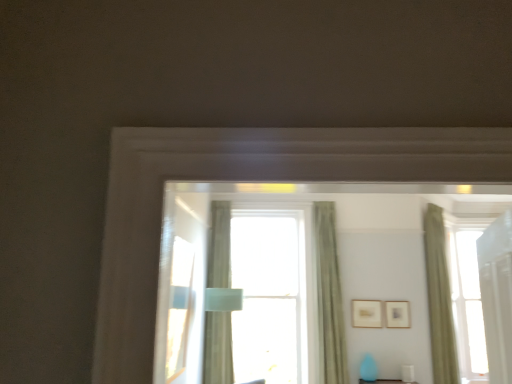
What is the approximate height of silky green curtain at center, placed as the 3th curtain when sorted from right to left?

It is 2.18 meters.

Where is `clear glass window at center`? clear glass window at center is located at coordinates (268, 295).

Find the location of a particular element. wooden picture frame at upper right, which is the 2th picture frame from right to left is located at coordinates (367, 313).

Describe the element at coordinates (367, 313) in the screenshot. I see `wooden picture frame at upper right, the first picture frame when ordered from left to right` at that location.

The width and height of the screenshot is (512, 384). In order to click on matte gold picture frame at upper center, the 2th picture frame in the left-to-right sequence in this screenshot , I will do `click(397, 314)`.

Which is in front, green textured curtain at center, placed as the 2th curtain when sorted from left to right, or silky green curtain at center, placed as the 3th curtain when sorted from right to left?

green textured curtain at center, placed as the 2th curtain when sorted from left to right, is more forward.

Between green textured curtain at center, arranged as the second curtain when viewed from the right, and silky green curtain at center, placed as the 3th curtain when sorted from right to left, which one appears on the right side from the viewer's perspective?

Positioned to the right is green textured curtain at center, arranged as the second curtain when viewed from the right.

This screenshot has height=384, width=512. I want to click on the 1st curtain below when counting from the green textured curtain at center, placed as the 2th curtain when sorted from left to right (from the image's perspective), so click(218, 349).

Who is taller, green textured curtain at center, placed as the 2th curtain when sorted from left to right, or silky green curtain at center, placed as the 3th curtain when sorted from right to left?

silky green curtain at center, placed as the 3th curtain when sorted from right to left, is taller.

Is wooden picture frame at upper right, the first picture frame when ordered from left to right, bigger than matte gold picture frame at upper center, the 2th picture frame in the left-to-right sequence?

Correct, wooden picture frame at upper right, the first picture frame when ordered from left to right, is larger in size than matte gold picture frame at upper center, the 2th picture frame in the left-to-right sequence.

The image size is (512, 384). Identify the location of picture frame located behind the matte gold picture frame at upper center, the 2th picture frame in the left-to-right sequence. (367, 313).

What's the angular difference between wooden picture frame at upper right, which is the 2th picture frame from right to left, and matte gold picture frame at upper center, positioned as the 1th picture frame in right-to-left order,'s facing directions?

The angular difference between wooden picture frame at upper right, which is the 2th picture frame from right to left, and matte gold picture frame at upper center, positioned as the 1th picture frame in right-to-left order, is 0.00336 degrees.

Considering the sizes of objects clear glass window at center and matte gold picture frame at upper center, positioned as the 1th picture frame in right-to-left order, in the image provided, who is shorter, clear glass window at center or matte gold picture frame at upper center, positioned as the 1th picture frame in right-to-left order,?

matte gold picture frame at upper center, positioned as the 1th picture frame in right-to-left order.

Is there a large distance between clear glass window at center and matte gold picture frame at upper center, the 2th picture frame in the left-to-right sequence?

Yes.

Could you tell me if clear glass window at center is turned towards matte gold picture frame at upper center, positioned as the 1th picture frame in right-to-left order?

No.

Is point (291, 326) more distant than point (406, 315)?

Yes, it is behind point (406, 315).

Is silky green curtain at center, placed as the 3th curtain when sorted from right to left, turned away from green textured curtain at center, placed as the 2th curtain when sorted from left to right?

No, silky green curtain at center, placed as the 3th curtain when sorted from right to left, is not facing away from green textured curtain at center, placed as the 2th curtain when sorted from left to right.

Which is in front, point (207, 277) or point (342, 315)?

The point (342, 315) is closer.

Would you say silky green curtain at center, the first curtain in the left-to-right sequence, is inside or outside green textured curtain at center, placed as the 2th curtain when sorted from left to right?

silky green curtain at center, the first curtain in the left-to-right sequence, is not enclosed by green textured curtain at center, placed as the 2th curtain when sorted from left to right.

Locate an element on the screen. This screenshot has width=512, height=384. curtain above the silky green curtain at center, the first curtain in the left-to-right sequence (from a real-world perspective) is located at coordinates (329, 297).

Between clear glass window at center and wooden picture frame at upper right, the first picture frame when ordered from left to right, which one has smaller size?

wooden picture frame at upper right, the first picture frame when ordered from left to right.

Is clear glass window at center not inside wooden picture frame at upper right, the first picture frame when ordered from left to right?

Yes, clear glass window at center is located beyond the bounds of wooden picture frame at upper right, the first picture frame when ordered from left to right.

Is clear glass window at center wider or thinner than wooden picture frame at upper right, the first picture frame when ordered from left to right?

In the image, clear glass window at center appears to be wider than wooden picture frame at upper right, the first picture frame when ordered from left to right.

From the image's perspective, is clear glass window at center on top of wooden picture frame at upper right, the first picture frame when ordered from left to right?

Yes, from the image's perspective, clear glass window at center is above wooden picture frame at upper right, the first picture frame when ordered from left to right.

From their relative heights in the image, would you say clear glass window at center is taller or shorter than green textured curtain at center, placed as the 2th curtain when sorted from left to right?

clear glass window at center is taller than green textured curtain at center, placed as the 2th curtain when sorted from left to right.

From the image's perspective, who appears lower, clear glass window at center or green textured curtain at center, arranged as the second curtain when viewed from the right?

clear glass window at center.

Is clear glass window at center touching green textured curtain at center, placed as the 2th curtain when sorted from left to right?

There is a gap between clear glass window at center and green textured curtain at center, placed as the 2th curtain when sorted from left to right.

Is wooden picture frame at upper right, the first picture frame when ordered from left to right, further to the viewer compared to silky green curtain at center, placed as the 3th curtain when sorted from right to left?

Yes.

From a real-world perspective, is wooden picture frame at upper right, which is the 2th picture frame from right to left, beneath silky green curtain at center, the first curtain in the left-to-right sequence?

Yes, from a real-world perspective, wooden picture frame at upper right, which is the 2th picture frame from right to left, is beneath silky green curtain at center, the first curtain in the left-to-right sequence.

Is wooden picture frame at upper right, the first picture frame when ordered from left to right, thinner than silky green curtain at center, the first curtain in the left-to-right sequence?

Correct, the width of wooden picture frame at upper right, the first picture frame when ordered from left to right, is less than that of silky green curtain at center, the first curtain in the left-to-right sequence.

Based on the photo, is wooden picture frame at upper right, the first picture frame when ordered from left to right, to the left or to the right of silky green curtain at center, the first curtain in the left-to-right sequence, in the image?

From the image, it's evident that wooden picture frame at upper right, the first picture frame when ordered from left to right, is to the right of silky green curtain at center, the first curtain in the left-to-right sequence.

Identify the location of the 1st curtain in front when counting from the silky green curtain at center, the first curtain in the left-to-right sequence. The image size is (512, 384). (329, 297).

This screenshot has height=384, width=512. Identify the location of picture frame on the right side of wooden picture frame at upper right, the first picture frame when ordered from left to right. (397, 314).

From the image, which object appears to be nearer to silky green curtain at center, placed as the 3th curtain when sorted from right to left, matte gold picture frame at upper center, positioned as the 1th picture frame in right-to-left order, or wooden picture frame at upper right, the first picture frame when ordered from left to right?

Based on the image, wooden picture frame at upper right, the first picture frame when ordered from left to right, appears to be nearer to silky green curtain at center, placed as the 3th curtain when sorted from right to left.

When comparing their distances from silky green curtain at center, placed as the 3th curtain when sorted from right to left, does clear glass window at center or wooden picture frame at upper right, which is the 2th picture frame from right to left, seem further?

Among the two, wooden picture frame at upper right, which is the 2th picture frame from right to left, is located further to silky green curtain at center, placed as the 3th curtain when sorted from right to left.

Estimate the real-world distances between objects in this image. Which object is further from green textured curtain at center, placed as the 2th curtain when sorted from left to right, matte gold picture frame at upper center, positioned as the 1th picture frame in right-to-left order, or green fabric curtain at right, arranged as the third curtain when viewed from the left?

green fabric curtain at right, arranged as the third curtain when viewed from the left.

Based on their spatial positions, is clear glass window at center or green fabric curtain at right, acting as the 1th curtain starting from the right, further from matte gold picture frame at upper center, positioned as the 1th picture frame in right-to-left order?

Among the two, green fabric curtain at right, acting as the 1th curtain starting from the right, is located further to matte gold picture frame at upper center, positioned as the 1th picture frame in right-to-left order.

Looking at this image, from the image, which object appears to be farther from green fabric curtain at right, arranged as the third curtain when viewed from the left, silky green curtain at center, the first curtain in the left-to-right sequence, or matte gold picture frame at upper center, positioned as the 1th picture frame in right-to-left order?

Among the two, silky green curtain at center, the first curtain in the left-to-right sequence, is located further to green fabric curtain at right, arranged as the third curtain when viewed from the left.

Which object lies further to the anchor point clear glass window at center, green textured curtain at center, arranged as the second curtain when viewed from the right, or green fabric curtain at right, acting as the 1th curtain starting from the right?

green fabric curtain at right, acting as the 1th curtain starting from the right, is positioned further to the anchor clear glass window at center.

Based on their spatial positions, is matte gold picture frame at upper center, positioned as the 1th picture frame in right-to-left order, or clear glass window at center closer to green textured curtain at center, placed as the 2th curtain when sorted from left to right?

The object closer to green textured curtain at center, placed as the 2th curtain when sorted from left to right, is clear glass window at center.

Which object lies further to the anchor point wooden picture frame at upper right, which is the 2th picture frame from right to left, matte gold picture frame at upper center, positioned as the 1th picture frame in right-to-left order, or clear glass window at center?

clear glass window at center lies further to wooden picture frame at upper right, which is the 2th picture frame from right to left, than the other object.

Identify the location of curtain situated between clear glass window at center and matte gold picture frame at upper center, the 2th picture frame in the left-to-right sequence, from left to right. (329, 297).

The image size is (512, 384). I want to click on window between silky green curtain at center, placed as the 3th curtain when sorted from right to left, and matte gold picture frame at upper center, positioned as the 1th picture frame in right-to-left order, from left to right, so click(268, 295).

The image size is (512, 384). Identify the location of curtain between clear glass window at center and wooden picture frame at upper right, the first picture frame when ordered from left to right, in the horizontal direction. (329, 297).

The image size is (512, 384). What are the coordinates of `curtain situated between silky green curtain at center, placed as the 3th curtain when sorted from right to left, and green fabric curtain at right, arranged as the third curtain when viewed from the left, from left to right` in the screenshot? It's located at (329, 297).